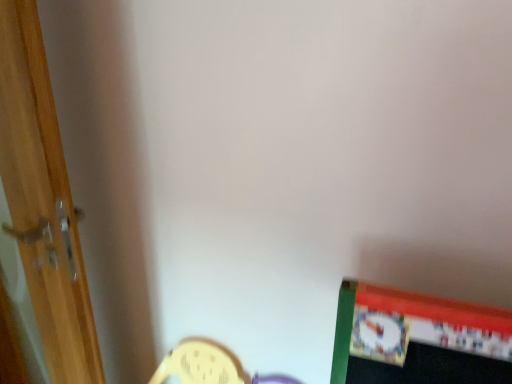
Where is `wooden door at left`? This screenshot has width=512, height=384. wooden door at left is located at coordinates (38, 223).

What do you see at coordinates (38, 223) in the screenshot? I see `wooden door at left` at bounding box center [38, 223].

The width and height of the screenshot is (512, 384). I want to click on wooden door at left, so click(38, 223).